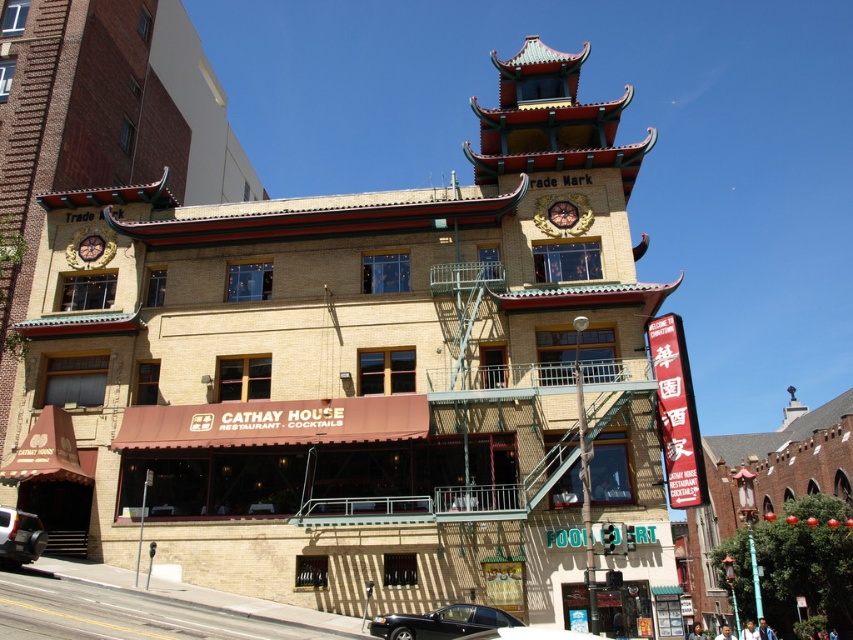
You are standing at the entrance of Cathay House restaurant and want to park your car. The parking lot is located at point 0.839, 0.023. Is the silver metallic car at lower left blocking your path to the parking spot?

The silver metallic car at lower left is located at point (19, 536), which is exactly where the parking spot is. Therefore, the silver metallic car at lower left is blocking your path to the parking spot.

In the scene shown: You are standing at the camera position and want to take a photo of the silver metallic car at lower left. The camera has a maximum zoom range of 30 meters. Can you capture the car without moving closer?

The silver metallic car at lower left and camera are 34.22 meters apart from each other. Since the camera can only zoom up to 30 meters, you cannot capture the car without moving closer.

You are standing at the entrance of Cathay House restaurant and want to park your car directly in front of the restaurant. Is the black glossy car at lower center currently blocking the parking spot?

The black glossy car at lower center is located at coordinates point (531, 634), which would be directly in front of the restaurant, so yes, it is blocking the parking spot.